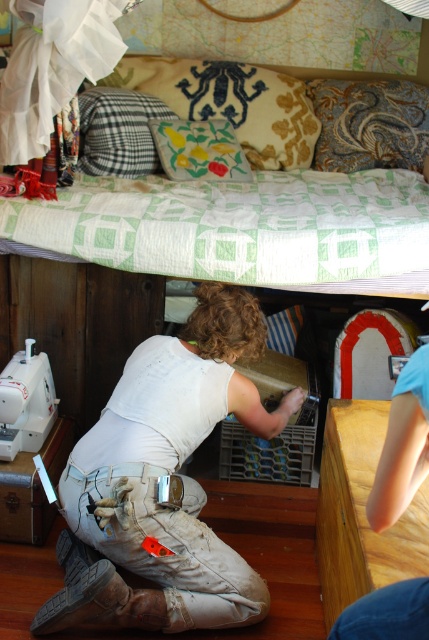
Is point (151, 516) closer to viewer compared to point (290, 124)?

That is True.

Does white cotton shirt at center have a smaller size compared to yellow fabric pillow at upper center?

No.

At what (x,y) coordinates should I click in order to perform the action: click on white cotton shirt at center. Please return your answer as a coordinate pair (x, y). This screenshot has height=640, width=429. Looking at the image, I should click on (156, 483).

Between point (30, 218) and point (220, 81), which one is positioned in front?

Point (30, 218) is in front.

Is green quilted bed at upper center smaller than yellow fabric pillow at upper center?

Incorrect, green quilted bed at upper center is not smaller in size than yellow fabric pillow at upper center.

Find the location of a particular element. The height and width of the screenshot is (640, 429). green quilted bed at upper center is located at coordinates (322, 221).

In order to click on green quilted bed at upper center in this screenshot , I will do `click(322, 221)`.

Does wooden table at lower right have a larger size compared to floral fabric cushion at upper center?

Incorrect, wooden table at lower right is not larger than floral fabric cushion at upper center.

Is wooden table at lower right to the right of floral fabric cushion at upper center from the viewer's perspective?

Indeed, wooden table at lower right is positioned on the right side of floral fabric cushion at upper center.

Measure the distance between point (407, 602) and camera.

Point (407, 602) is 3.52 feet from camera.

Identify the location of wooden table at lower right. (402, 445).